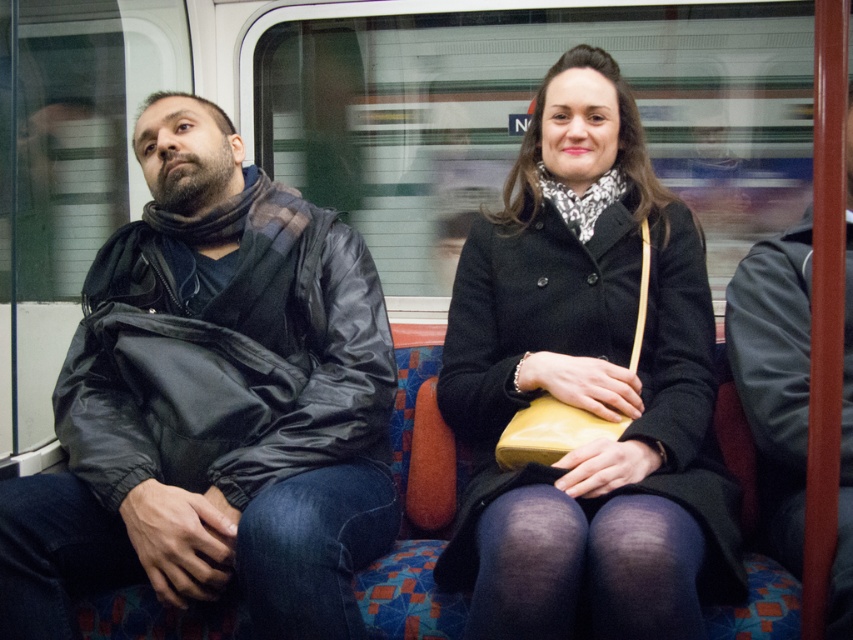
Question: Which point appears farthest from the camera in this image?

Choices:
 (A) (767, 502)
 (B) (294, 260)

Answer: (B)

Question: Which point appears closest to the camera in this image?

Choices:
 (A) (751, 250)
 (B) (196, 476)

Answer: (B)

Question: Which object is the farthest from the leather jacket at right?

Choices:
 (A) matte black jacket at left
 (B) black matte coat at center

Answer: (A)

Question: Is black matte coat at center above leather jacket at right?

Choices:
 (A) yes
 (B) no

Answer: (A)

Question: Is matte black jacket at left below leather jacket at right?

Choices:
 (A) no
 (B) yes

Answer: (A)

Question: Where is matte black jacket at left located in relation to leather jacket at right in the image?

Choices:
 (A) above
 (B) below

Answer: (A)